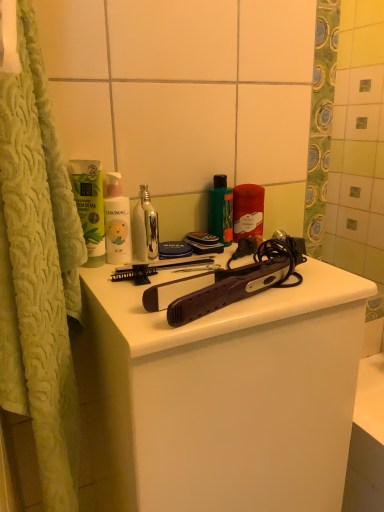
Question: Should I look upward or downward to see matte black hair straightener at center?

Choices:
 (A) down
 (B) up

Answer: (A)

Question: Can you confirm if matte black hair straightener at center is thinner than white matte bottle at center, which ranks as the first cleaning product in left-to-right order?

Choices:
 (A) yes
 (B) no

Answer: (B)

Question: Is matte black hair straightener at center shorter than white matte bottle at center, which ranks as the first cleaning product in left-to-right order?

Choices:
 (A) no
 (B) yes

Answer: (A)

Question: Considering the relative positions of matte black hair straightener at center and white matte bottle at center, the first cleaning product positioned from the front, in the image provided, is matte black hair straightener at center to the right of white matte bottle at center, the first cleaning product positioned from the front, from the viewer's perspective?

Choices:
 (A) yes
 (B) no

Answer: (A)

Question: From a real-world perspective, is matte black hair straightener at center on white matte bottle at center, which is the 2th cleaning product in back-to-front order?

Choices:
 (A) no
 (B) yes

Answer: (A)

Question: Is matte black hair straightener at center to the left of white matte bottle at center, which is the 2th cleaning product in back-to-front order, from the viewer's perspective?

Choices:
 (A) no
 (B) yes

Answer: (A)

Question: Does matte black hair straightener at center have a smaller size compared to white matte bottle at center, which is the 2th cleaning product in right-to-left order?

Choices:
 (A) yes
 (B) no

Answer: (B)

Question: From the image's perspective, does metallic silver bottle at center, arranged as the second mouthwash when viewed from the left, appear lower than green glossy bottle at center, which is counted as the first mouthwash, starting from the right?

Choices:
 (A) no
 (B) yes

Answer: (B)

Question: Is metallic silver bottle at center, arranged as the second mouthwash when viewed from the left, to the right of green glossy bottle at center, which is counted as the first mouthwash, starting from the right, from the viewer's perspective?

Choices:
 (A) no
 (B) yes

Answer: (A)

Question: Is metallic silver bottle at center, the second mouthwash when ordered from right to left, positioned far away from green glossy bottle at center, which appears as the third mouthwash when viewed from the left?

Choices:
 (A) no
 (B) yes

Answer: (A)

Question: Can you confirm if metallic silver bottle at center, the second mouthwash when ordered from right to left, is positioned to the left of green glossy bottle at center, which appears as the third mouthwash when viewed from the left?

Choices:
 (A) yes
 (B) no

Answer: (A)

Question: From the image's perspective, is metallic silver bottle at center, arranged as the second mouthwash when viewed from the left, over green glossy bottle at center, which is counted as the first mouthwash, starting from the right?

Choices:
 (A) yes
 (B) no

Answer: (B)

Question: Is metallic silver bottle at center, arranged as the second mouthwash when viewed from the left, shorter than green glossy bottle at center, which is counted as the first mouthwash, starting from the right?

Choices:
 (A) yes
 (B) no

Answer: (A)

Question: Is green matte tube at upper left, which ranks as the 3th mouthwash in right-to-left order, closer to the viewer compared to matte red candle at center, the first cleaning product viewed from the back?

Choices:
 (A) yes
 (B) no

Answer: (A)